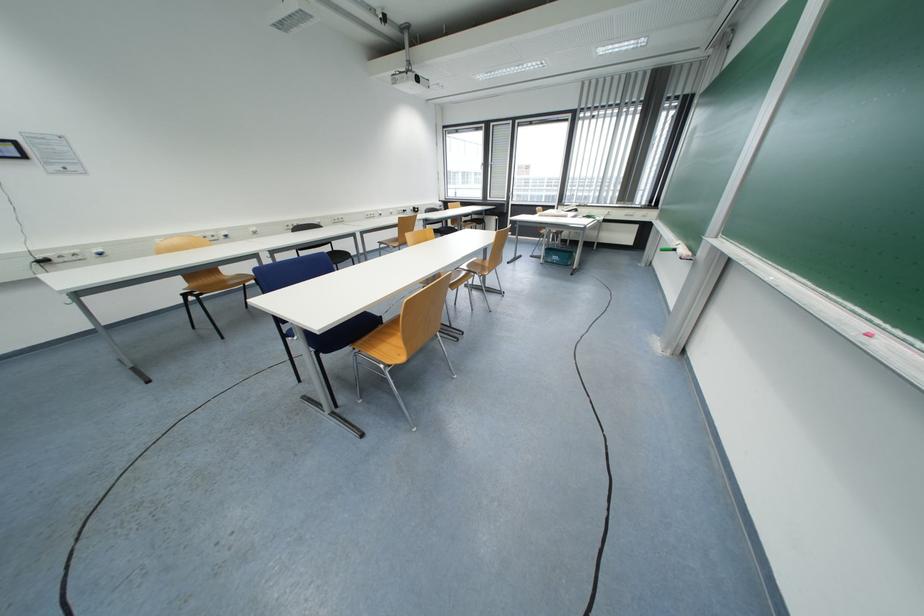
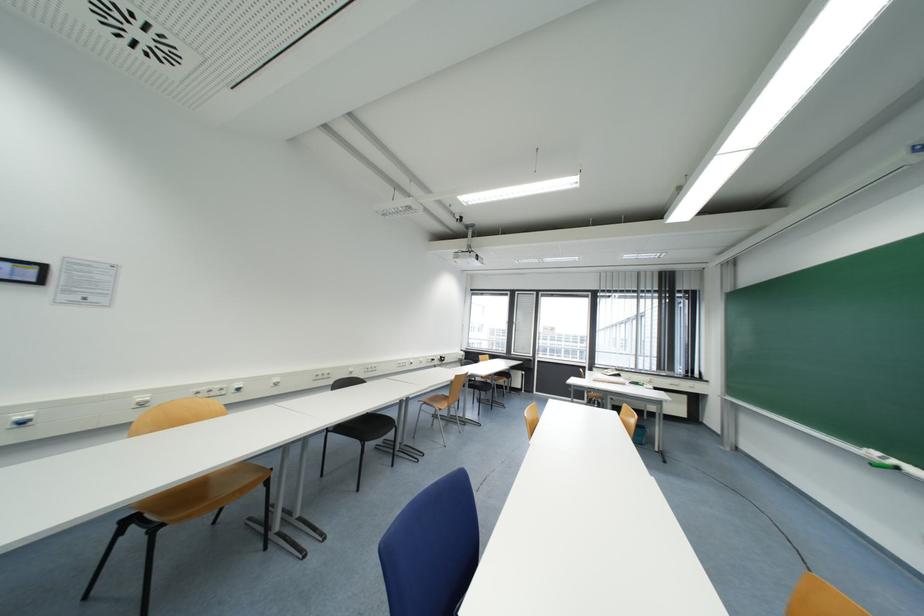
Where in the second image is the point corresponding to pixel 104 256 from the first image?

(28, 424)